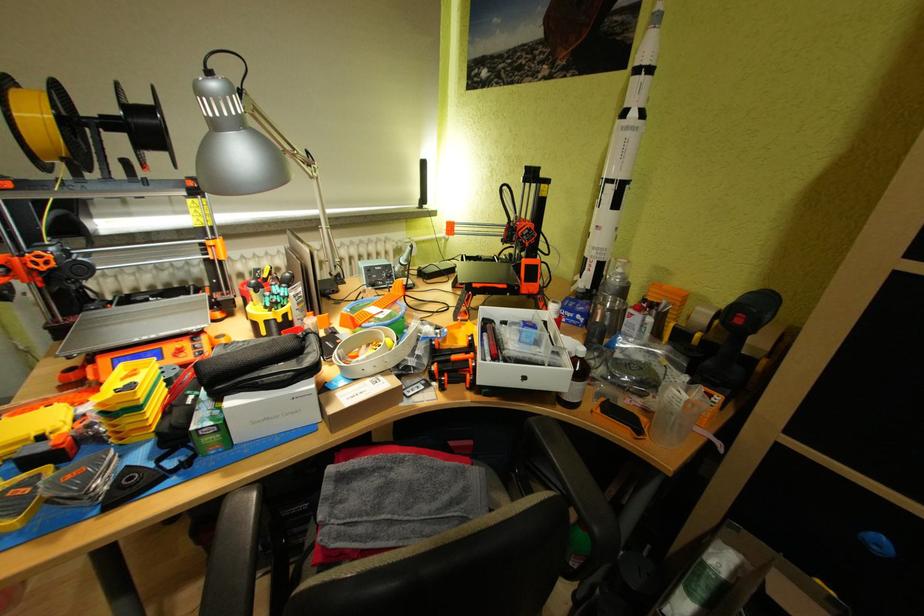
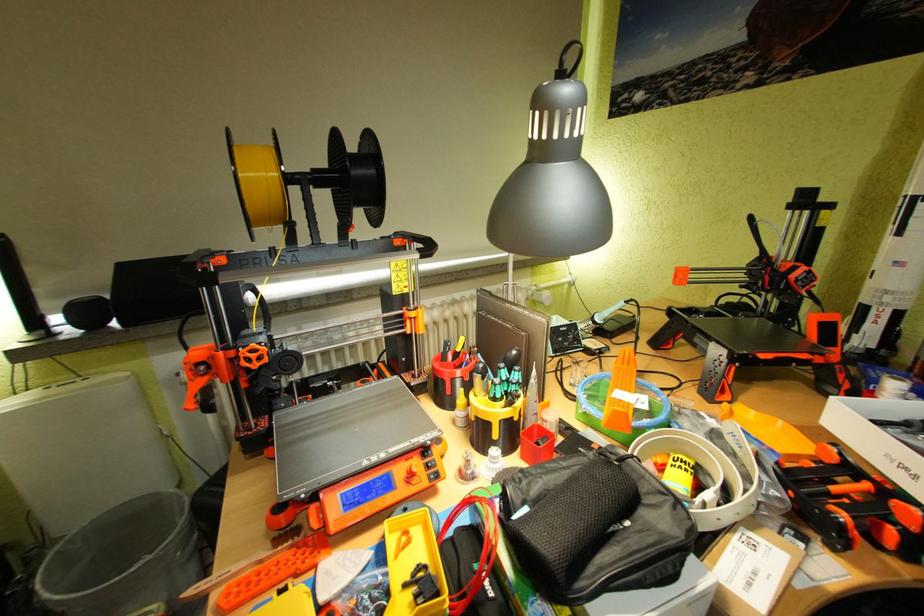
Question: The first image is from the beginning of the video and the second image is from the end. How did the camera likely rotate when shooting the video?

Choices:
 (A) Left
 (B) Right
 (C) Up
 (D) Down

Answer: (A)